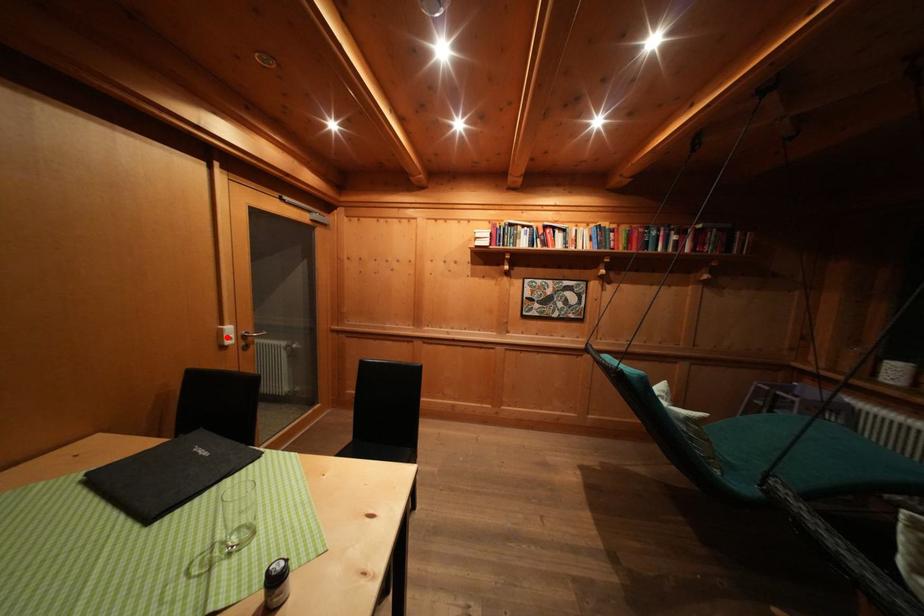
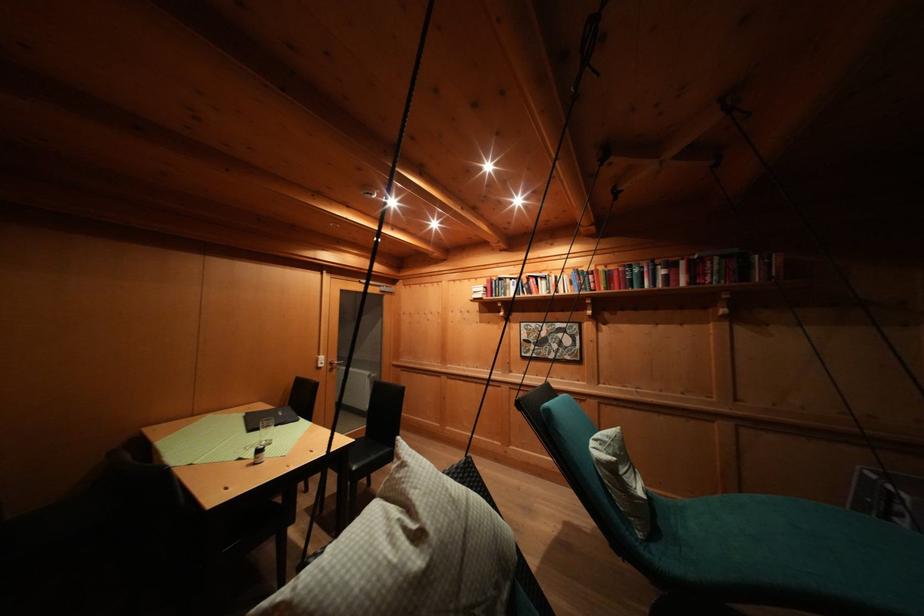
In the second image, find the point that corresponds to the highlighted location in the first image.

(323, 363)